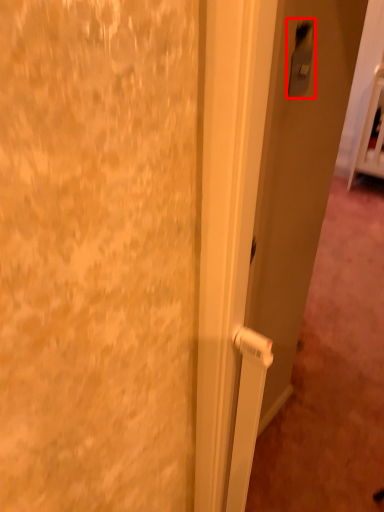
Question: From the image's perspective, considering the relative positions of light switch (annotated by the red box) and door in the image provided, where is light switch (annotated by the red box) located with respect to the staircase?

Choices:
 (A) above
 (B) below

Answer: (A)